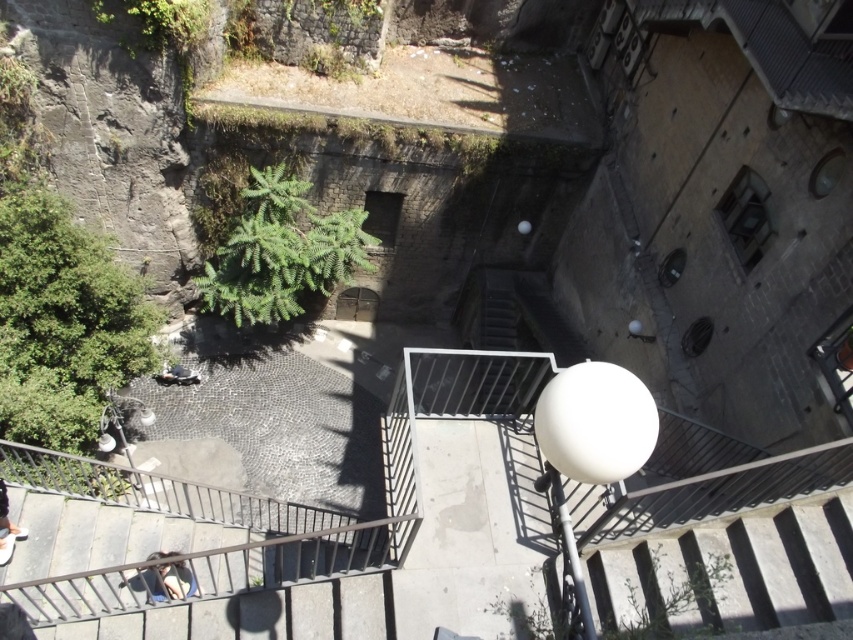
Is white glossy stairwell at lower right to the left of dark blue jeans at bottom left from the viewer's perspective?

In fact, white glossy stairwell at lower right is to the right of dark blue jeans at bottom left.

Which is above, white glossy stairwell at lower right or dark blue jeans at bottom left?

white glossy stairwell at lower right is above.

Is point (801, 541) farther from viewer compared to point (9, 536)?

No, (801, 541) is in front of (9, 536).

Locate an element on the screen. white glossy stairwell at lower right is located at coordinates (730, 572).

I want to click on white glossy stairwell at lower right, so click(730, 572).

Where is `white glossy stairwell at lower right`? white glossy stairwell at lower right is located at coordinates (730, 572).

At what (x,y) coordinates should I click in order to perform the action: click on dark blue jeans at lower left. Please return your answer as a coordinate pair (x, y). Image resolution: width=853 pixels, height=640 pixels. Looking at the image, I should click on tap(170, 580).

This screenshot has width=853, height=640. What do you see at coordinates (170, 580) in the screenshot?
I see `dark blue jeans at lower left` at bounding box center [170, 580].

This screenshot has height=640, width=853. What are the coordinates of `dark blue jeans at lower left` in the screenshot? It's located at (170, 580).